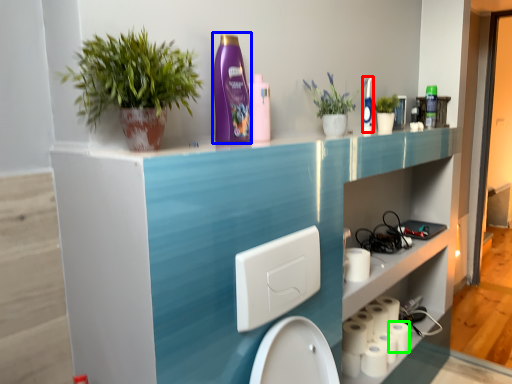
Question: Which object is the closest to the cleaning product (highlighted by a red box)? Choose among these: cleaning product (highlighted by a blue box) or toilet paper (highlighted by a green box).

Choices:
 (A) cleaning product
 (B) toilet paper

Answer: (A)